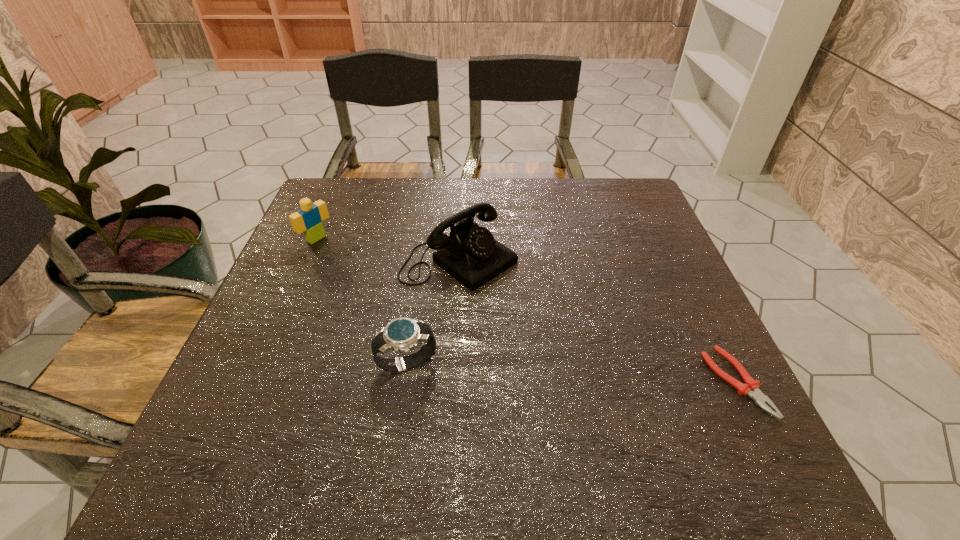
The height and width of the screenshot is (540, 960). In order to click on free space on the desktop that is between the watch and the pliers and is positioned on the face of the leftmost object in this screenshot , I will do `click(532, 371)`.

At what (x,y) coordinates should I click in order to perform the action: click on vacant space on the desktop that is between the second shortest object and the rightmost object and is positioned on the front face of the telephone. Please return your answer as a coordinate pair (x, y). Looking at the image, I should click on (615, 376).